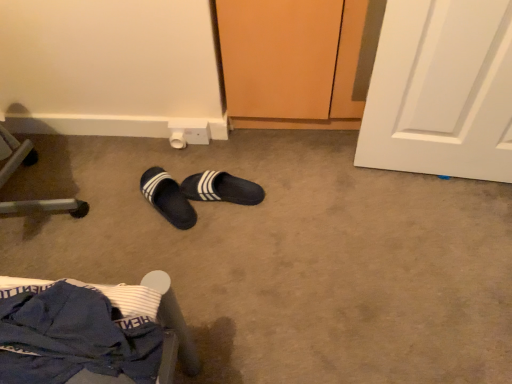
Question: Which direction should I rotate to look at black fabric slippers at center, the 1th footwear viewed from the right, — up or down?

Choices:
 (A) up
 (B) down

Answer: (A)

Question: Would you say blue fabric chair at lower left is a long distance from black fuzzy slippers at center, which is counted as the first footwear, starting from the left?

Choices:
 (A) no
 (B) yes

Answer: (A)

Question: Does blue fabric chair at lower left have a larger size compared to black fuzzy slippers at center, the 2th footwear when ordered from right to left?

Choices:
 (A) yes
 (B) no

Answer: (A)

Question: Is blue fabric chair at lower left wider than black fuzzy slippers at center, which is counted as the first footwear, starting from the left?

Choices:
 (A) no
 (B) yes

Answer: (A)

Question: From a real-world perspective, is blue fabric chair at lower left on top of black fuzzy slippers at center, the 2th footwear when ordered from right to left?

Choices:
 (A) no
 (B) yes

Answer: (B)

Question: Is blue fabric chair at lower left to the left of black fuzzy slippers at center, the 2th footwear when ordered from right to left, from the viewer's perspective?

Choices:
 (A) yes
 (B) no

Answer: (B)

Question: From the image's perspective, is blue fabric chair at lower left over black fuzzy slippers at center, the 2th footwear when ordered from right to left?

Choices:
 (A) no
 (B) yes

Answer: (A)

Question: Is black fabric slippers at center, the 1th footwear viewed from the right, positioned beyond the bounds of black fuzzy slippers at center, the 2th footwear when ordered from right to left?

Choices:
 (A) no
 (B) yes

Answer: (B)

Question: From a real-world perspective, is black fabric slippers at center, the 1th footwear viewed from the right, below black fuzzy slippers at center, the 2th footwear when ordered from right to left?

Choices:
 (A) yes
 (B) no

Answer: (A)

Question: From a real-world perspective, is black fabric slippers at center, the 1th footwear viewed from the right, over black fuzzy slippers at center, which is counted as the first footwear, starting from the left?

Choices:
 (A) yes
 (B) no

Answer: (B)

Question: Can you confirm if black fabric slippers at center, the 2th footwear in the left-to-right sequence, is shorter than black fuzzy slippers at center, the 2th footwear when ordered from right to left?

Choices:
 (A) yes
 (B) no

Answer: (B)

Question: Is black fabric slippers at center, the 2th footwear in the left-to-right sequence, wider than black fuzzy slippers at center, the 2th footwear when ordered from right to left?

Choices:
 (A) no
 (B) yes

Answer: (A)

Question: Does black fabric slippers at center, the 1th footwear viewed from the right, lie behind black fuzzy slippers at center, which is counted as the first footwear, starting from the left?

Choices:
 (A) no
 (B) yes

Answer: (B)

Question: Does black fabric slippers at center, the 2th footwear in the left-to-right sequence, have a greater width compared to blue fabric chair at lower left?

Choices:
 (A) no
 (B) yes

Answer: (A)